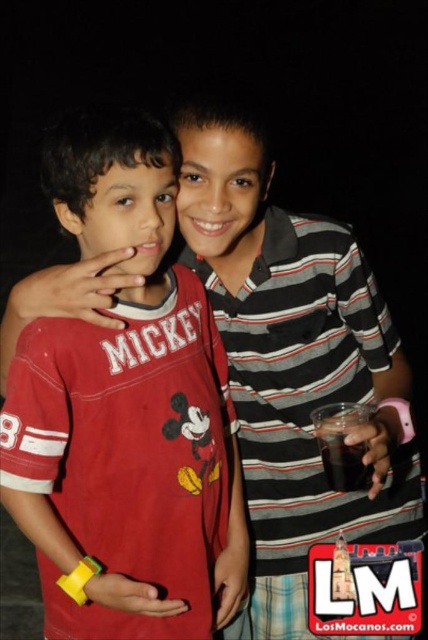
Question: Is red cotton shirt at center below dark brown liquid at right?

Choices:
 (A) yes
 (B) no

Answer: (B)

Question: Which of the following is the farthest from the observer?

Choices:
 (A) (321, 456)
 (B) (89, 445)

Answer: (A)

Question: From the image, what is the correct spatial relationship of red cotton shirt at center in relation to dark brown liquid at right?

Choices:
 (A) above
 (B) below

Answer: (A)

Question: Does red cotton shirt at center appear over dark brown liquid at right?

Choices:
 (A) yes
 (B) no

Answer: (A)